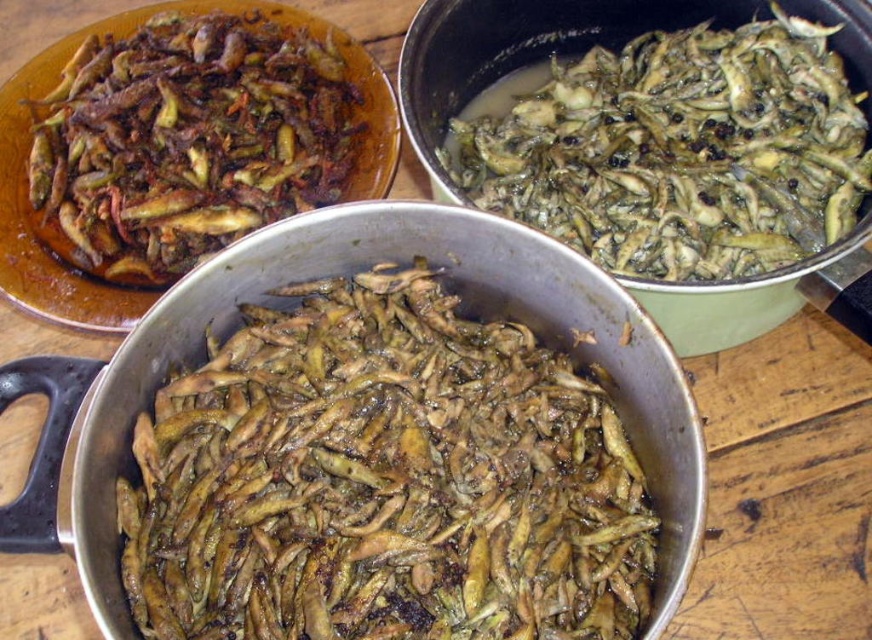
Does brown matte fish at center appear on the right side of brown matte fried fish at upper left?

Indeed, brown matte fish at center is positioned on the right side of brown matte fried fish at upper left.

Between point (403, 561) and point (112, 182), which one is positioned in front?

Positioned in front is point (403, 561).

Identify the location of brown matte fish at center. Image resolution: width=872 pixels, height=640 pixels. (385, 480).

Does point (519, 49) lie in front of point (325, 166)?

No, it is behind (325, 166).

Can you confirm if greenish-brown glossy fish at upper right is smaller than brown matte fried fish at upper left?

Actually, greenish-brown glossy fish at upper right might be larger than brown matte fried fish at upper left.

The height and width of the screenshot is (640, 872). I want to click on greenish-brown glossy fish at upper right, so click(671, 141).

You are a GUI agent. You are given a task and a screenshot of the screen. Output one action in this format:
    pyautogui.click(x=<x>, y=<y>)
    Task: Click on the greenish-brown glossy fish at upper right
    
    Given the screenshot: What is the action you would take?
    pyautogui.click(x=671, y=141)

Is brown matte fish at center shorter than greenish-brown glossy fish at upper right?

Yes, brown matte fish at center is shorter than greenish-brown glossy fish at upper right.

Consider the image. Which of these two, brown matte fish at center or greenish-brown glossy fish at upper right, stands shorter?

brown matte fish at center

Does point (576, 595) come behind point (736, 125)?

No, it is not.

Where is `brown matte fish at center`? This screenshot has width=872, height=640. brown matte fish at center is located at coordinates (385, 480).